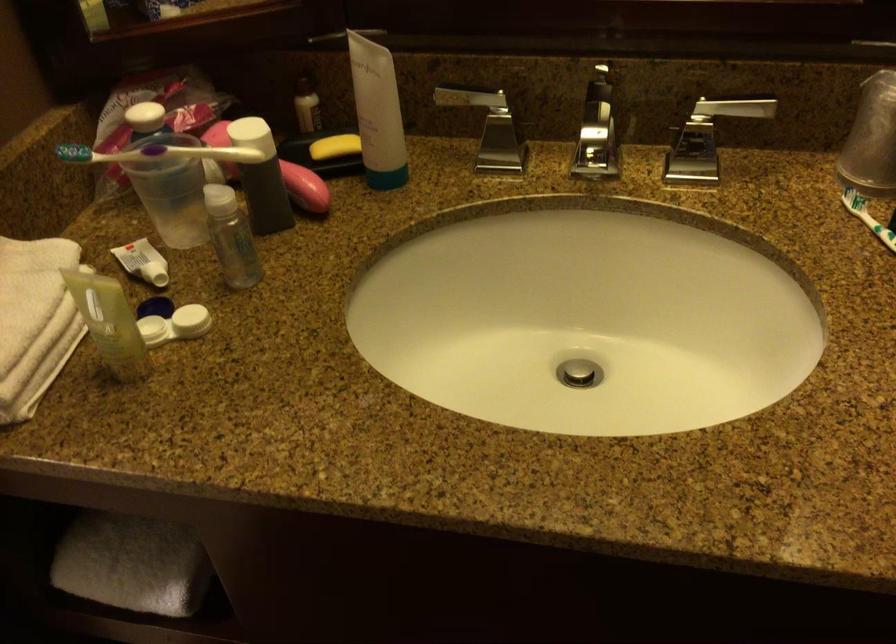
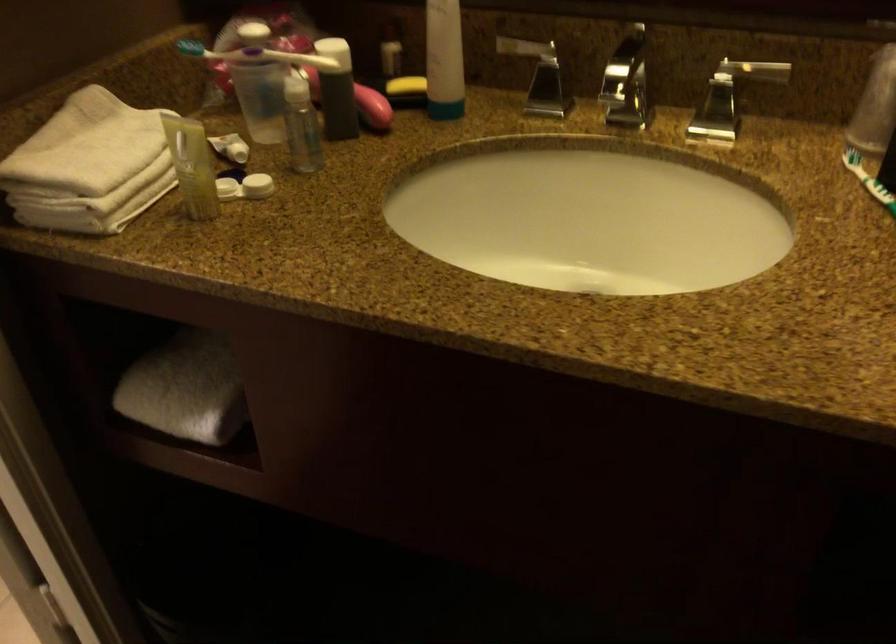
The point at (161,152) is marked in the first image. Where is the corresponding point in the second image?

(259, 55)